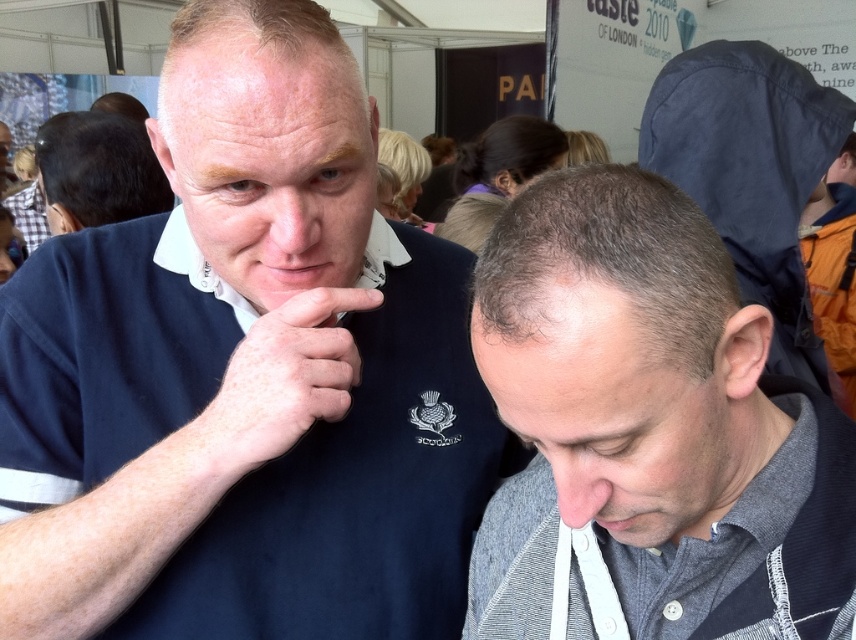
Is pale skin/hair at center below matte skin nose at center?

Indeed, pale skin/hair at center is positioned under matte skin nose at center.

What do you see at coordinates (284, 378) in the screenshot?
I see `pale skin/hair at center` at bounding box center [284, 378].

This screenshot has width=856, height=640. Identify the location of pale skin/hair at center. (284, 378).

What do you see at coordinates (284, 378) in the screenshot? The height and width of the screenshot is (640, 856). I see `pale skin/hair at center` at bounding box center [284, 378].

Is point (251, 435) farther from camera compared to point (568, 464)?

Yes.

At what (x,y) coordinates should I click in order to perform the action: click on pale skin/hair at center. Please return your answer as a coordinate pair (x, y). The width and height of the screenshot is (856, 640). Looking at the image, I should click on (284, 378).

Locate an element on the screen. The height and width of the screenshot is (640, 856). dark blue polo shirt at upper left is located at coordinates (244, 380).

Which is in front, point (467, 548) or point (571, 356)?

Point (571, 356) is in front.

What do you see at coordinates (244, 380) in the screenshot?
I see `dark blue polo shirt at upper left` at bounding box center [244, 380].

Where is `dark blue polo shirt at upper left`? The width and height of the screenshot is (856, 640). dark blue polo shirt at upper left is located at coordinates (244, 380).